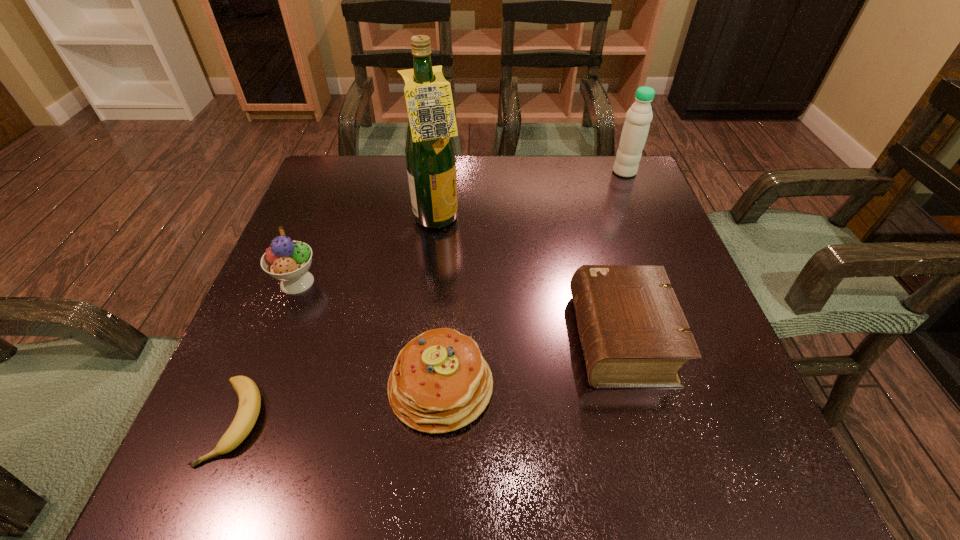
The height and width of the screenshot is (540, 960). In order to click on vacant area that lies between the fifth object from left to right and the pancake in this screenshot , I will do `click(531, 362)`.

Identify which object is located as the second nearest to the pancake. Please provide its 2D coordinates. Your answer should be formatted as a tuple, i.e. [(x, y)], where the tuple contains the x and y coordinates of a point satisfying the conditions above.

[(249, 395)]

Where is `object that stands as the fifth closest to the third tallest object`? This screenshot has height=540, width=960. object that stands as the fifth closest to the third tallest object is located at coordinates (639, 116).

The height and width of the screenshot is (540, 960). Identify the location of free point that satisfies the following two spatial constraints: 1. on the spine side of the Bible; 2. at the stem of the shortest object. (644, 421).

What are the coordinates of `free space that satisfies the following two spatial constraints: 1. on the back side of the second tallest object; 2. on the right side of the icecream` in the screenshot? It's located at (341, 172).

What are the coordinates of `free spot that satisfies the following two spatial constraints: 1. on the spine side of the Bible; 2. at the stem of the shortest object` in the screenshot? It's located at (644, 421).